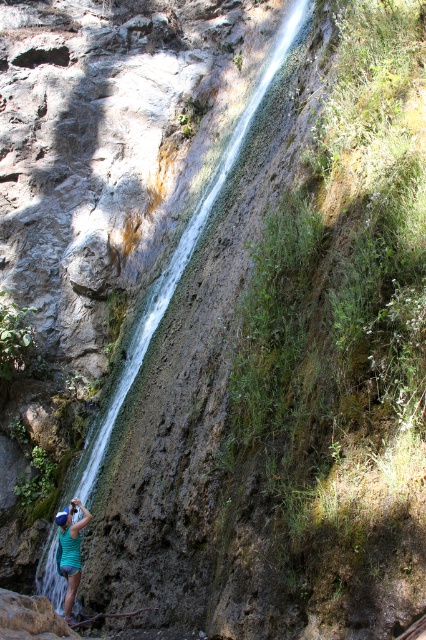
Question: Which object appears farthest from the camera in this image?

Choices:
 (A) clear water at center
 (B) green fabric shirt at lower left

Answer: (A)

Question: Is clear water at center to the right of green fabric shirt at lower left from the viewer's perspective?

Choices:
 (A) yes
 (B) no

Answer: (A)

Question: Is clear water at center above green fabric shirt at lower left?

Choices:
 (A) no
 (B) yes

Answer: (B)

Question: Can you confirm if clear water at center is positioned above green fabric shirt at lower left?

Choices:
 (A) yes
 (B) no

Answer: (A)

Question: Among these objects, which one is nearest to the camera?

Choices:
 (A) green fabric shirt at lower left
 (B) clear water at center

Answer: (A)